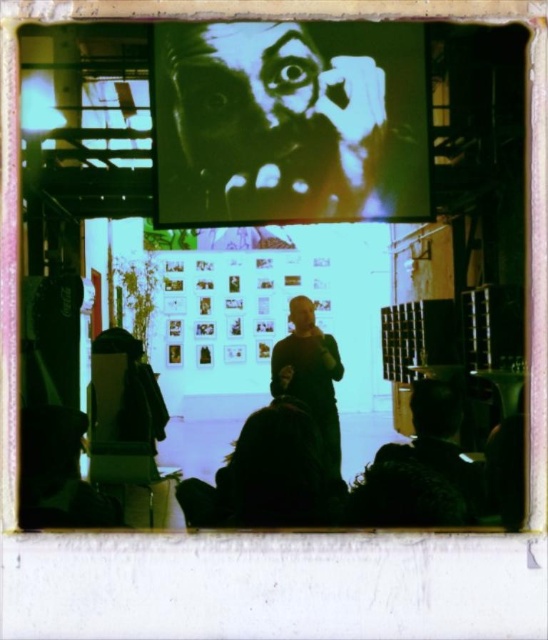
Who is higher up, high contrast face at center or dark brown leather jacket at center?

Positioned higher is high contrast face at center.

Can you confirm if high contrast face at center is positioned below dark brown leather jacket at center?

Incorrect, high contrast face at center is not positioned below dark brown leather jacket at center.

The image size is (548, 640). Identify the location of high contrast face at center. (275, 122).